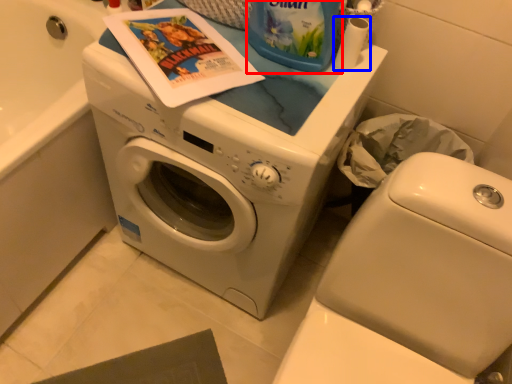
Question: Which object appears farthest to the camera in this image, cleaning product (highlighted by a red box) or toilet paper (highlighted by a blue box)?

Choices:
 (A) cleaning product
 (B) toilet paper

Answer: (B)